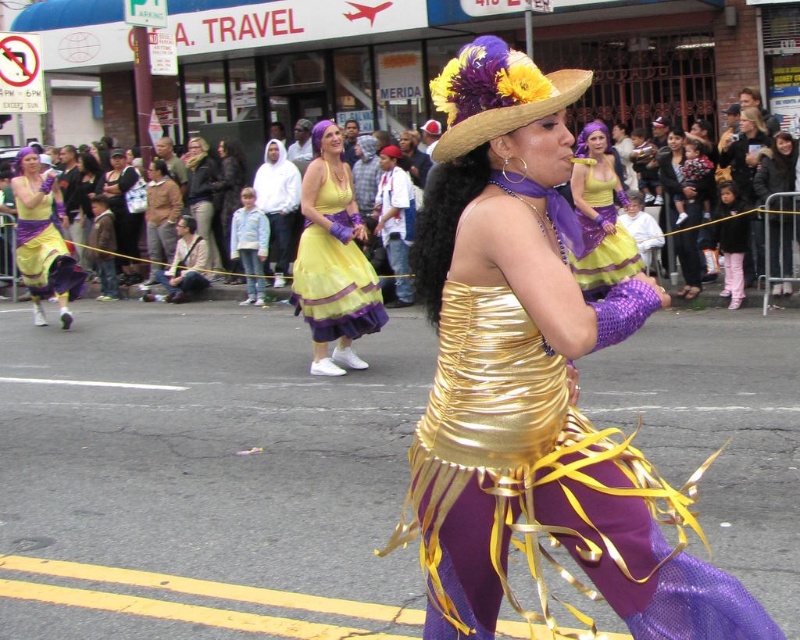
Question: Does shiny purple dress at center appear on the left side of pink fabric pants at right?

Choices:
 (A) no
 (B) yes

Answer: (B)

Question: Among these points, which one is nearest to the camera?

Choices:
 (A) (460, 128)
 (B) (169, 196)

Answer: (A)

Question: Is matte yellow dress at center positioned before matte brown jacket at center?

Choices:
 (A) no
 (B) yes

Answer: (B)

Question: Can you confirm if matte black jacket at upper right is positioned to the right of matte black jacket at upper center?

Choices:
 (A) no
 (B) yes

Answer: (B)

Question: Among these objects, which one is farthest from the camera?

Choices:
 (A) matte yellow dress at center
 (B) shiny purple dress at center
 (C) matte black jacket at center
 (D) matte black jacket at upper center

Answer: (D)

Question: Which point appears closest to the camera in this image?

Choices:
 (A) (498, 100)
 (B) (325, 324)
 (C) (150, 250)

Answer: (A)